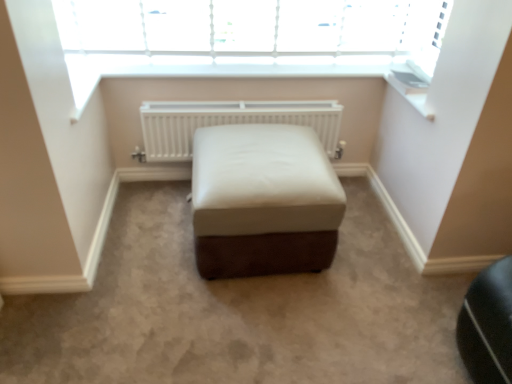
Measure the distance between point [426,95] and camera.

Point [426,95] and camera are 5.88 feet apart.

Locate an element on the screen. Image resolution: width=512 pixels, height=384 pixels. white matte radiator at center is located at coordinates (231, 123).

The image size is (512, 384). Find the location of `white plastic window sill at upper right`. white plastic window sill at upper right is located at coordinates (411, 90).

Is white leather ottoman at center not near white plastic window sill at upper right?

No.

Does white leather ottoman at center have a lesser width compared to white plastic window sill at upper right?

Incorrect, the width of white leather ottoman at center is not less than that of white plastic window sill at upper right.

Does white leather ottoman at center contain white plastic window sill at upper right?

Actually, white plastic window sill at upper right is outside white leather ottoman at center.

Is white plastic window sill at upper right facing away from white leather ottoman at center?

white plastic window sill at upper right is not turned away from white leather ottoman at center.

Which of these two, white plastic window sill at upper right or white leather ottoman at center, is wider?

Wider between the two is white leather ottoman at center.

Which is in front, point (424, 98) or point (223, 185)?

The point (223, 185) is in front.

From the image's perspective, is white plastic window sill at upper right over white leather ottoman at center?

Yes, from the image's perspective, white plastic window sill at upper right is over white leather ottoman at center.

Between white matte radiator at center and white leather ottoman at center, which one has larger width?

Wider between the two is white leather ottoman at center.

Where is `furniture lying below the white matte radiator at center (from the image's perspective)`? The image size is (512, 384). furniture lying below the white matte radiator at center (from the image's perspective) is located at coordinates (263, 201).

Between white matte radiator at center and white leather ottoman at center, which one appears on the right side from the viewer's perspective?

From the viewer's perspective, white leather ottoman at center appears more on the right side.

Can you tell me how much white leather ottoman at center and white matte radiator at center differ in facing direction?

1.11 degrees separate the facing orientations of white leather ottoman at center and white matte radiator at center.

Considering the positions of objects white leather ottoman at center and white matte radiator at center in the image provided, who is more to the left, white leather ottoman at center or white matte radiator at center?

Positioned to the left is white matte radiator at center.

Can you confirm if white leather ottoman at center is shorter than white matte radiator at center?

No.

Consider the image. Are white leather ottoman at center and white matte radiator at center making contact?

white leather ottoman at center and white matte radiator at center are clearly separated.

Which of these two, white plastic window sill at upper right or white matte radiator at center, is bigger?

white matte radiator at center is bigger.

Would you consider white plastic window sill at upper right to be distant from white matte radiator at center?

No, there isn't a large distance between white plastic window sill at upper right and white matte radiator at center.

Is white plastic window sill at upper right in front of or behind white matte radiator at center in the image?

Visually, white plastic window sill at upper right is located in front of white matte radiator at center.

Is white plastic window sill at upper right thinner than white matte radiator at center?

No.

Is white matte radiator at center smaller than white plastic window sill at upper right?

No.

Is white matte radiator at center looking in the opposite direction of white plastic window sill at upper right?

white matte radiator at center does not have its back to white plastic window sill at upper right.

Is white plastic window sill at upper right inside white matte radiator at center?

That's incorrect, white plastic window sill at upper right is not inside white matte radiator at center.

From the picture: What's the angular difference between white matte radiator at center and white plastic window sill at upper right's facing directions?

The angle between the facing direction of white matte radiator at center and the facing direction of white plastic window sill at upper right is 0.0639 degrees.

The image size is (512, 384). I want to click on window sill that appears behind the white leather ottoman at center, so click(x=411, y=90).

This screenshot has width=512, height=384. Find the location of `furniture to the left of white plastic window sill at upper right`. furniture to the left of white plastic window sill at upper right is located at coordinates (263, 201).

Which object lies further to the anchor point white plastic window sill at upper right, white leather ottoman at center or white matte radiator at center?

white leather ottoman at center.

Looking at the image, which one is located further to white plastic window sill at upper right, white matte radiator at center or white leather ottoman at center?

Among the two, white leather ottoman at center is located further to white plastic window sill at upper right.

Which object lies further to the anchor point white matte radiator at center, white plastic window sill at upper right or white leather ottoman at center?

The object further to white matte radiator at center is white plastic window sill at upper right.

Estimate the real-world distances between objects in this image. Which object is further from white matte radiator at center, white leather ottoman at center or white plastic window sill at upper right?

white plastic window sill at upper right is further to white matte radiator at center.

When comparing their distances from white leather ottoman at center, does white plastic window sill at upper right or white matte radiator at center seem further?

white plastic window sill at upper right lies further to white leather ottoman at center than the other object.

Looking at the image, which one is located closer to white leather ottoman at center, white matte radiator at center or white plastic window sill at upper right?

Based on the image, white matte radiator at center appears to be nearer to white leather ottoman at center.

The height and width of the screenshot is (384, 512). What are the coordinates of `furniture situated between white matte radiator at center and white plastic window sill at upper right from left to right` in the screenshot? It's located at (263, 201).